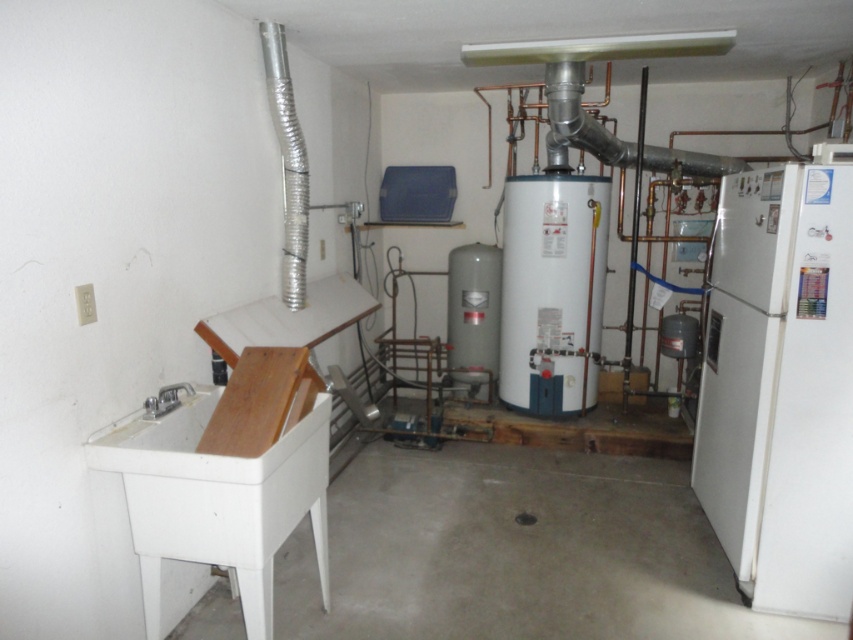
Question: Can you confirm if white glossy water heater at center right is positioned below silver metallic duct at upper left?

Choices:
 (A) no
 (B) yes

Answer: (B)

Question: Which point is farther from the camera taking this photo?

Choices:
 (A) (282, 93)
 (B) (483, 340)
 (C) (521, 182)
 (D) (727, 355)

Answer: (B)

Question: Considering the real-world distances, which object is closest to the gray matte water heater at center?

Choices:
 (A) silver metallic duct at upper left
 (B) white matte refrigerator at right
 (C) white glossy water heater at center right

Answer: (C)

Question: Can you confirm if white matte refrigerator at right is positioned above silver metallic duct at upper left?

Choices:
 (A) yes
 (B) no

Answer: (B)

Question: Can you confirm if white glossy water heater at center right is bigger than silver metallic duct at upper left?

Choices:
 (A) no
 (B) yes

Answer: (B)

Question: Which point is closer to the camera?

Choices:
 (A) (265, 61)
 (B) (709, 484)
 (C) (457, 253)

Answer: (A)